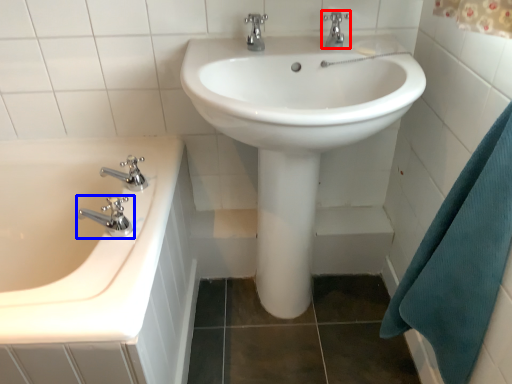
Question: Which object is further to the camera taking this photo, tap (highlighted by a red box) or tap (highlighted by a blue box)?

Choices:
 (A) tap
 (B) tap

Answer: (A)